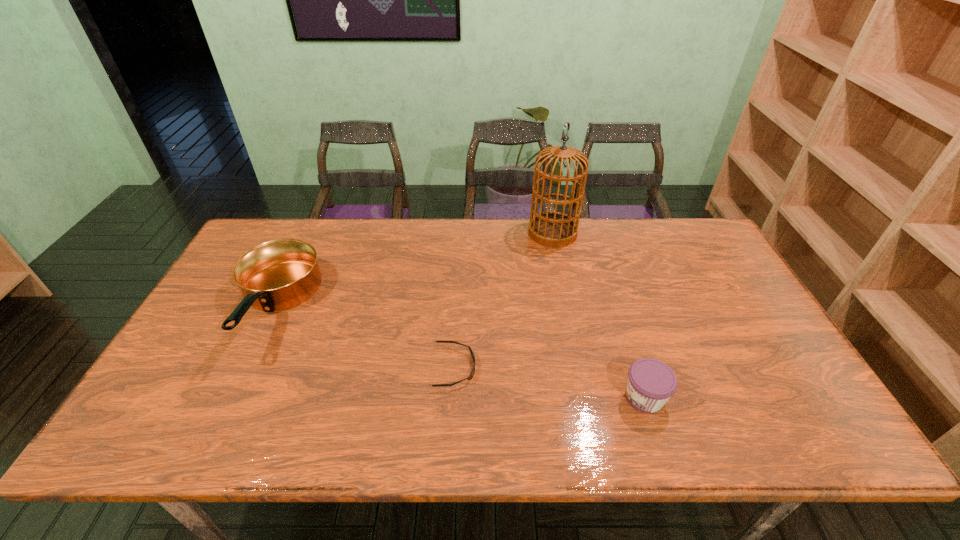
The height and width of the screenshot is (540, 960). Find the location of `empty space that is in between the frying pan and the second shortest object`. empty space that is in between the frying pan and the second shortest object is located at coordinates (459, 352).

Locate an element on the screen. This screenshot has height=540, width=960. empty space that is in between the third object from right to left and the jam is located at coordinates (550, 382).

Where is `vacant point located between the frying pan and the tallest object`? This screenshot has height=540, width=960. vacant point located between the frying pan and the tallest object is located at coordinates (414, 269).

This screenshot has height=540, width=960. Identify the location of object that is the third nearest to the frying pan. (651, 383).

Identify the location of object that stands as the third closest to the third object from right to left. Image resolution: width=960 pixels, height=540 pixels. (552, 229).